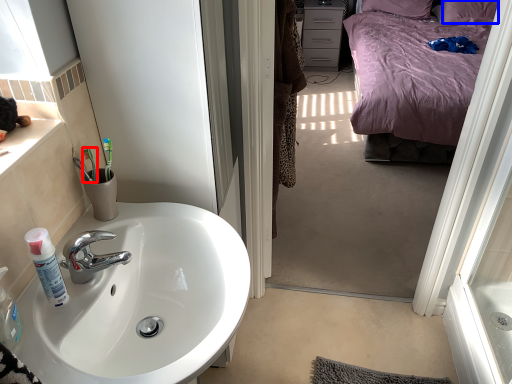
Question: Which object is further to the camera taking this photo, toothbrush (highlighted by a red box) or pillow (highlighted by a blue box)?

Choices:
 (A) toothbrush
 (B) pillow

Answer: (B)